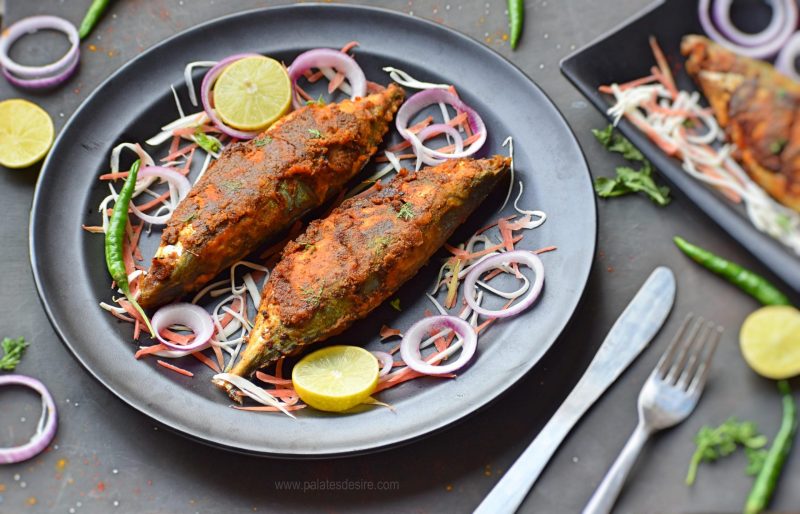
The width and height of the screenshot is (800, 514). In order to click on fork in this screenshot , I will do `click(662, 407)`.